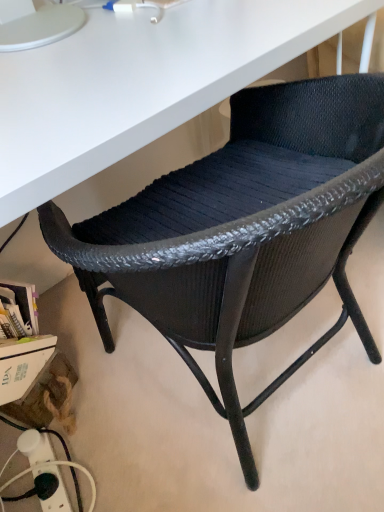
I want to click on free space below black woven chair at center (from a real-world perspective), so click(x=271, y=401).